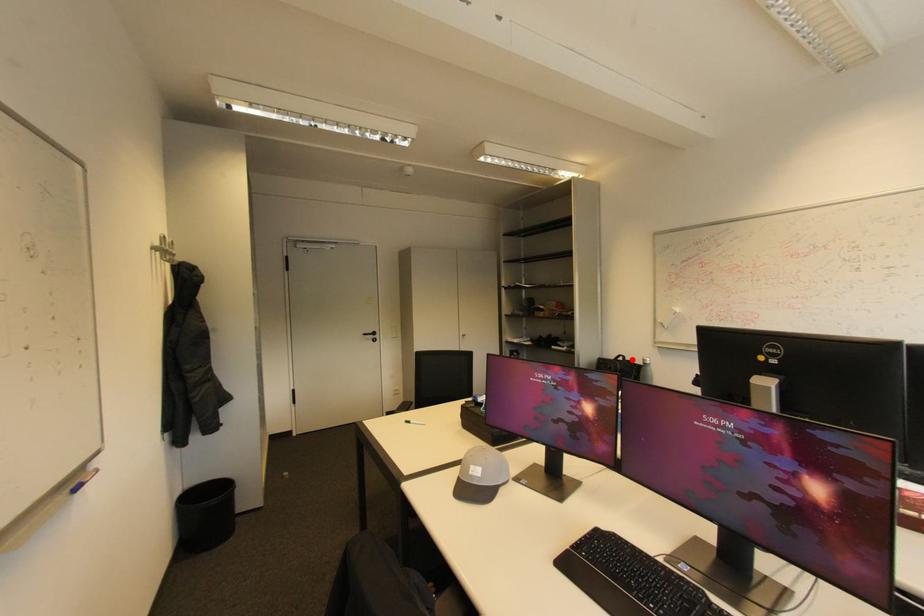
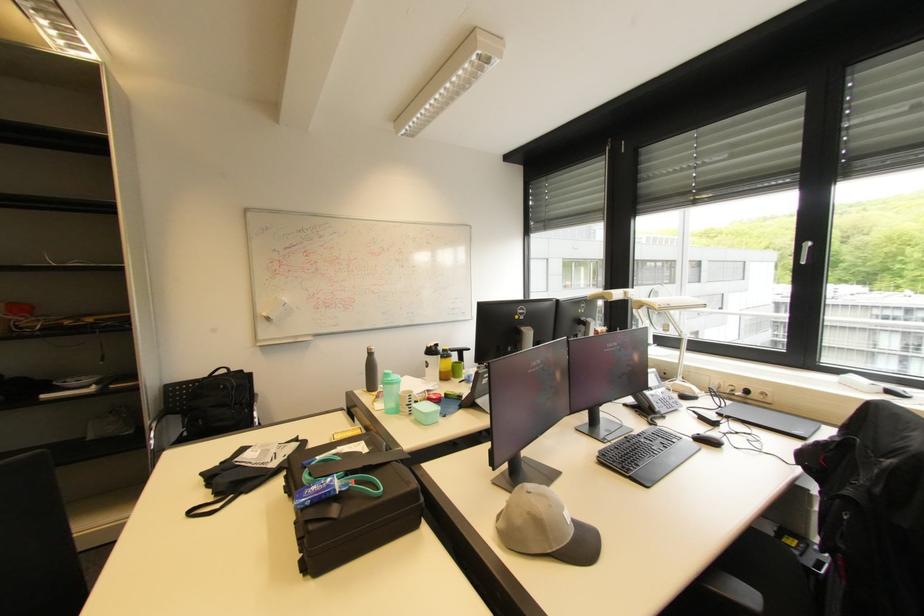
Where in the second image is the point corresponding to the highlighted location from the first image?

(237, 371)